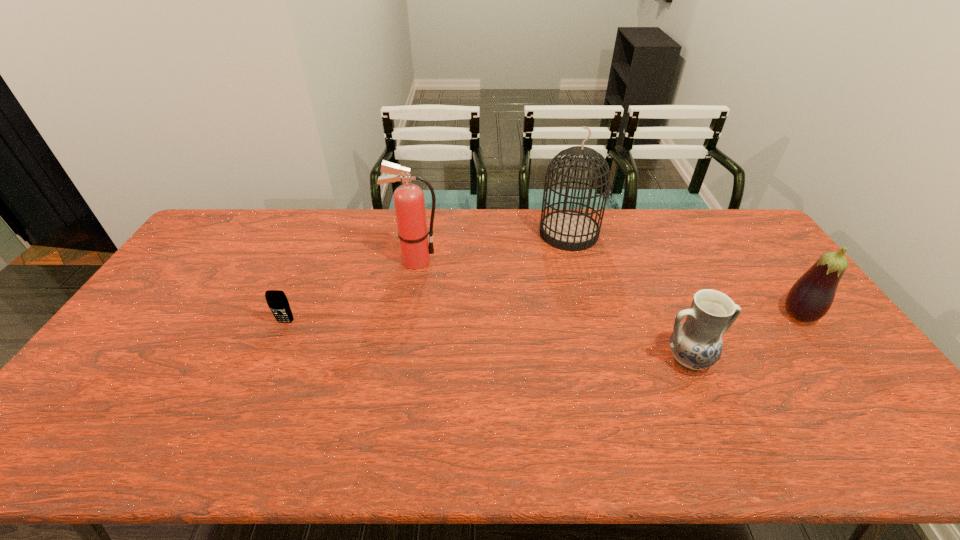
In the image, there is a desktop. What are the coordinates of `vacant space at the near right corner` in the screenshot? It's located at (910, 450).

Locate an element on the screen. Image resolution: width=960 pixels, height=540 pixels. blank region between the third tallest object and the nearest object is located at coordinates (743, 338).

This screenshot has width=960, height=540. What are the coordinates of `free spot between the pottery and the third object from right to left` in the screenshot? It's located at (629, 296).

This screenshot has width=960, height=540. I want to click on vacant point located between the farthest object and the rightmost object, so click(x=684, y=274).

The height and width of the screenshot is (540, 960). I want to click on empty space that is in between the eggplant and the cellular telephone, so click(542, 319).

This screenshot has height=540, width=960. Identify the location of free spot between the eggplant and the fourth nearest object. (607, 288).

Image resolution: width=960 pixels, height=540 pixels. Find the location of `empty space between the fire extinguisher and the third object from left to right`. empty space between the fire extinguisher and the third object from left to right is located at coordinates (492, 247).

At what (x,y) coordinates should I click in order to perform the action: click on free space between the birdcage and the fourth object from left to right. Please return your answer as a coordinate pair (x, y). Image resolution: width=960 pixels, height=540 pixels. Looking at the image, I should click on (629, 296).

Where is `free space that is in between the leftmost object and the farthest object`? This screenshot has width=960, height=540. free space that is in between the leftmost object and the farthest object is located at coordinates (427, 278).

Locate an element on the screen. The image size is (960, 540). blank region between the fourth tallest object and the fourth nearest object is located at coordinates (552, 310).